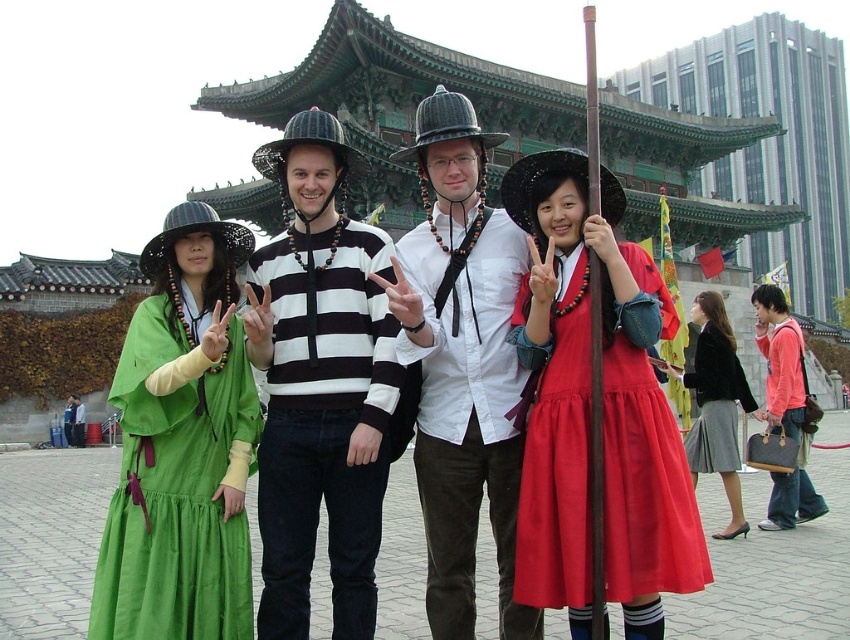
Does white striped sweater at center appear over gray pleated skirt at lower right?

Correct, white striped sweater at center is located above gray pleated skirt at lower right.

Is white striped sweater at center further to the viewer compared to gray pleated skirt at lower right?

No, white striped sweater at center is closer to the viewer.

Which is in front, point (459, 310) or point (714, 470)?

Point (459, 310) is more forward.

This screenshot has width=850, height=640. What are the coordinates of `white striped sweater at center` in the screenshot? It's located at (462, 364).

Between point (534, 451) and point (709, 412), which one is positioned in front?

Point (534, 451) is in front.

Is matte red dress at center to the left of gray pleated skirt at lower right from the viewer's perspective?

Correct, you'll find matte red dress at center to the left of gray pleated skirt at lower right.

Image resolution: width=850 pixels, height=640 pixels. Identify the location of matte red dress at center. (588, 410).

This screenshot has height=640, width=850. I want to click on matte red dress at center, so click(588, 410).

Does point (276, 237) come farther from viewer compared to point (180, 467)?

Yes, point (276, 237) is farther from viewer.

Between point (354, 442) and point (231, 392), which one is positioned behind?

Point (231, 392)

Who is more distant from viewer, [354,298] or [230,269]?

Positioned behind is point [230,269].

What are the coordinates of `striped sweater at center` in the screenshot? It's located at (320, 384).